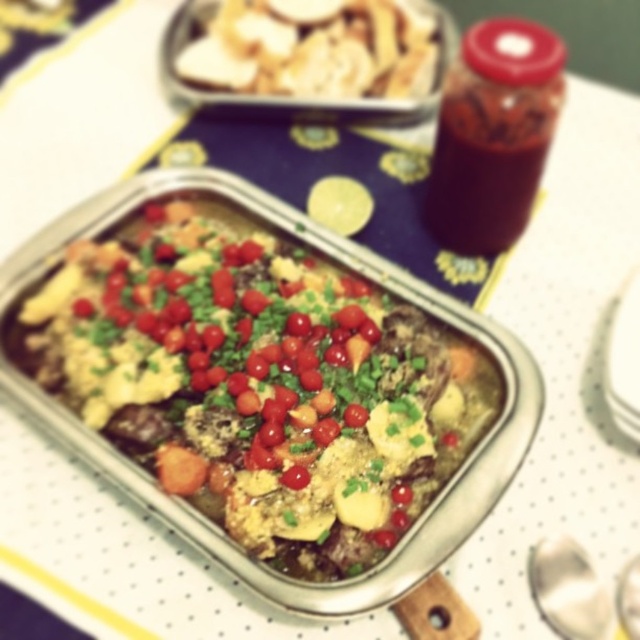
Is slightly browned baked dish at center smaller than white crumbly at upper center?

Actually, slightly browned baked dish at center might be larger than white crumbly at upper center.

Is point (166, 250) farther from viewer compared to point (342, 51)?

No, it is in front of (342, 51).

At what (x,y) coordinates should I click in order to perform the action: click on slightly browned baked dish at center. Please return your answer as a coordinate pair (x, y). Looking at the image, I should click on coord(259,381).